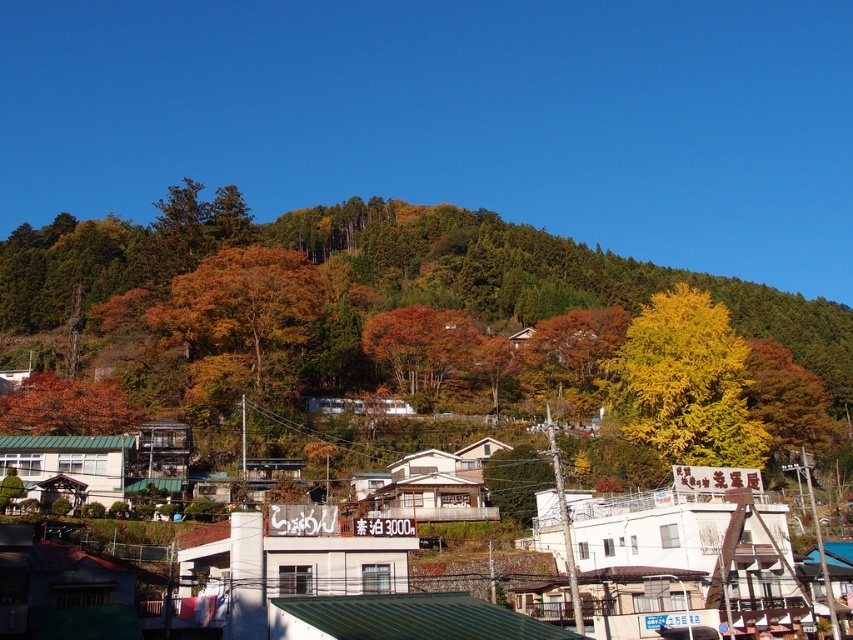
You are standing in the residential area at the foot of the hill. There is a point marked at coordinates (399,323). What object is located at this point?

The yellow golden leaves at upper center are located at point (399,323).